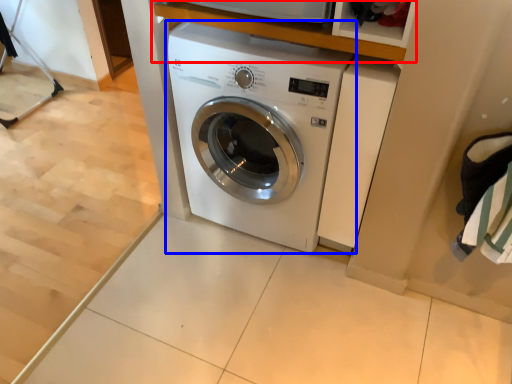
Question: Which object appears farthest to the camera in this image, shelf (highlighted by a red box) or washing machine (highlighted by a blue box)?

Choices:
 (A) shelf
 (B) washing machine

Answer: (B)